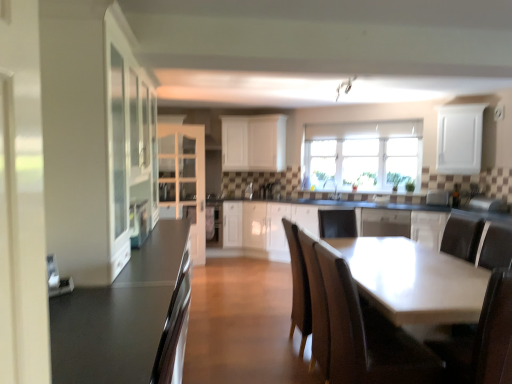
Question: Relative to clear glass windows at upper center, is wooden chair at lower right in front or behind?

Choices:
 (A) behind
 (B) front

Answer: (B)

Question: From the image's perspective, is wooden chair at lower right above or below clear glass windows at upper center?

Choices:
 (A) below
 (B) above

Answer: (A)

Question: Estimate the real-world distances between objects in this image. Which object is farther from the white matte cabinet at upper right, which appears as the 5th cabinetry when viewed from the back?

Choices:
 (A) white matte cabinet at upper center, marked as the third cabinetry in a right-to-left arrangement
 (B) white matte cabinet at upper center, positioned as the first cabinetry in back-to-front order
 (C) white glossy dishwasher at center
 (D) satin silver toaster at center, placed as the 2th appliance when sorted from right to left
 (E) white glass cabinet at left, the first cabinetry positioned from the left

Answer: (E)

Question: Based on their relative distances, which object is nearer to the white glossy dishwasher at center?

Choices:
 (A) clear glass windows at upper center
 (B) white glossy cabinet at left, which is counted as the 6th cabinetry, starting from the back
 (C) white glossy cabinet at center, acting as the fourth cabinetry starting from the back
 (D) white glossy dishwasher at center, which is the second appliance in bottom-to-top order
 (E) white glass cabinet at left, acting as the third cabinetry starting from the back

Answer: (D)